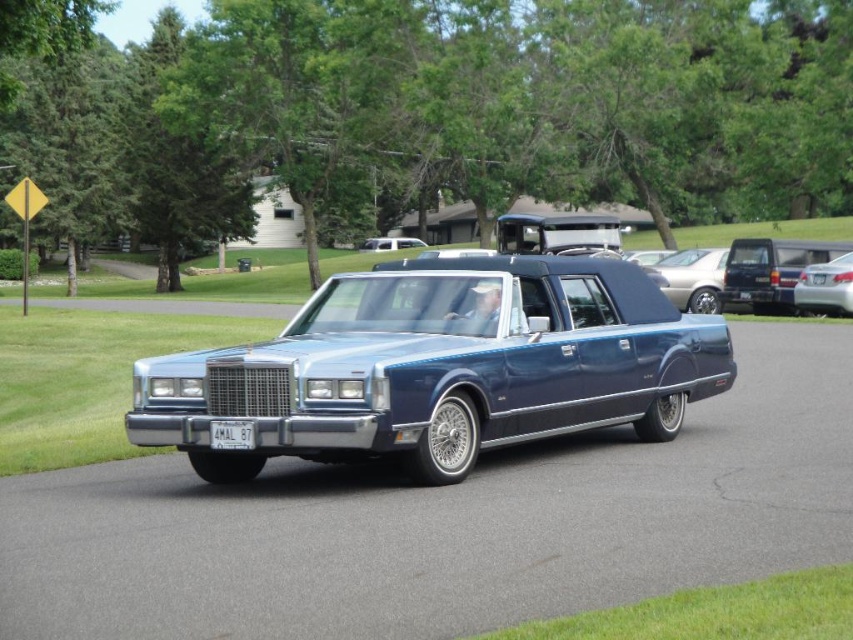
Question: Is metallic blue car at center thinner than matte black limousine at center?

Choices:
 (A) yes
 (B) no

Answer: (B)

Question: Estimate the real-world distances between objects in this image. Which object is farther from the matte black limousine at center?

Choices:
 (A) silver metallic sedan at center-right
 (B) metallic blue sedan at right
 (C) white plastic license plate at center
 (D) metallic blue sedan at center

Answer: (D)

Question: Which point is closer to the camera?

Choices:
 (A) white plastic license plate at center
 (B) matte black limousine at center
 (C) silver metallic sedan at center-right

Answer: (A)

Question: Can you confirm if white plastic license plate at center is wider than matte black limousine at center?

Choices:
 (A) yes
 (B) no

Answer: (B)

Question: Which object is closer to the camera taking this photo?

Choices:
 (A) matte black limousine at center
 (B) metallic blue car at center
 (C) silver metallic sedan at center-right

Answer: (B)

Question: Can you confirm if metallic blue sedan at right is thinner than white plastic license plate at center?

Choices:
 (A) no
 (B) yes

Answer: (A)